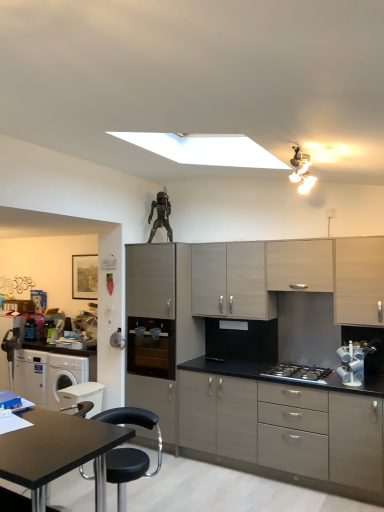
Question: Considering the relative positions of white plastic washing machine at lower left, the 1th appliance viewed from the left, and matte gray cabinet at center, which appears as the 1th cabinetry when viewed from the left, in the image provided, is white plastic washing machine at lower left, the 1th appliance viewed from the left, behind matte gray cabinet at center, which appears as the 1th cabinetry when viewed from the left,?

Choices:
 (A) yes
 (B) no

Answer: (A)

Question: Is white plastic washing machine at lower left, which is counted as the second appliance, starting from the right, looking in the opposite direction of matte gray cabinet at center, the 4th cabinetry in the right-to-left sequence?

Choices:
 (A) no
 (B) yes

Answer: (A)

Question: Are white plastic washing machine at lower left, which is the second appliance from front to back, and matte gray cabinet at center, which appears as the 1th cabinetry when viewed from the left, making contact?

Choices:
 (A) yes
 (B) no

Answer: (B)

Question: From the image's perspective, is white plastic washing machine at lower left, arranged as the 1th appliance when ordered from the bottom, on matte gray cabinet at center, the 4th cabinetry in the right-to-left sequence?

Choices:
 (A) yes
 (B) no

Answer: (B)

Question: Can you confirm if white plastic washing machine at lower left, arranged as the 1th appliance when ordered from the bottom, is positioned to the right of matte gray cabinet at center, which appears as the 1th cabinetry when viewed from the left?

Choices:
 (A) no
 (B) yes

Answer: (A)

Question: From the image's perspective, would you say white plastic washing machine at lower left, which is the second appliance from front to back, is shown under stainless steel gas stove at center?

Choices:
 (A) no
 (B) yes

Answer: (B)

Question: Does white plastic washing machine at lower left, which is the second appliance from front to back, have a greater height compared to stainless steel gas stove at center?

Choices:
 (A) no
 (B) yes

Answer: (B)

Question: Considering the relative sizes of white plastic washing machine at lower left, the 1th appliance viewed from the left, and stainless steel gas stove at center in the image provided, is white plastic washing machine at lower left, the 1th appliance viewed from the left, bigger than stainless steel gas stove at center?

Choices:
 (A) no
 (B) yes

Answer: (B)

Question: Considering the relative sizes of white plastic washing machine at lower left, which appears as the first appliance when viewed from the back, and stainless steel gas stove at center in the image provided, is white plastic washing machine at lower left, which appears as the first appliance when viewed from the back, thinner than stainless steel gas stove at center?

Choices:
 (A) no
 (B) yes

Answer: (B)

Question: Is white plastic washing machine at lower left, the second appliance positioned from the top, not inside stainless steel gas stove at center?

Choices:
 (A) yes
 (B) no

Answer: (A)

Question: Is white plastic washing machine at lower left, arranged as the 1th appliance when ordered from the bottom, far from stainless steel gas stove at center?

Choices:
 (A) no
 (B) yes

Answer: (B)

Question: Is light wood cabinet at center, arranged as the 3th cabinetry when viewed from the right, wider than matte gray cabinet at center, which appears as the 1th cabinetry when viewed from the left?

Choices:
 (A) yes
 (B) no

Answer: (B)